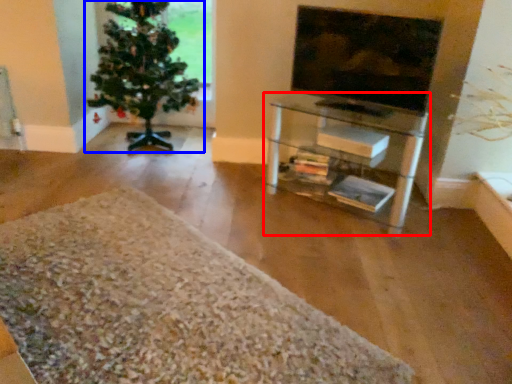
Question: Which object appears farthest to the camera in this image, shelf (highlighted by a red box) or houseplant (highlighted by a blue box)?

Choices:
 (A) shelf
 (B) houseplant

Answer: (B)